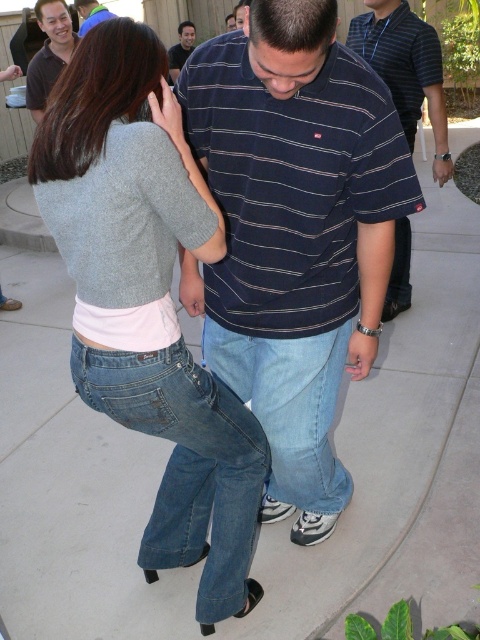
You are a photographer standing 10 feet away from the two people in the scene. You want to take a photo of both the dark blue striped shirt at center and the matte black polo shirt at upper left in the same frame. Can you capture both shirts in the same photo without moving your position?

The dark blue striped shirt at center and the matte black polo shirt at upper left are 6.62 feet apart. Since you are 10 feet away from them, the distance between the two shirts is less than the distance from you to them, so yes, you can capture both shirts in the same photo without moving your position.